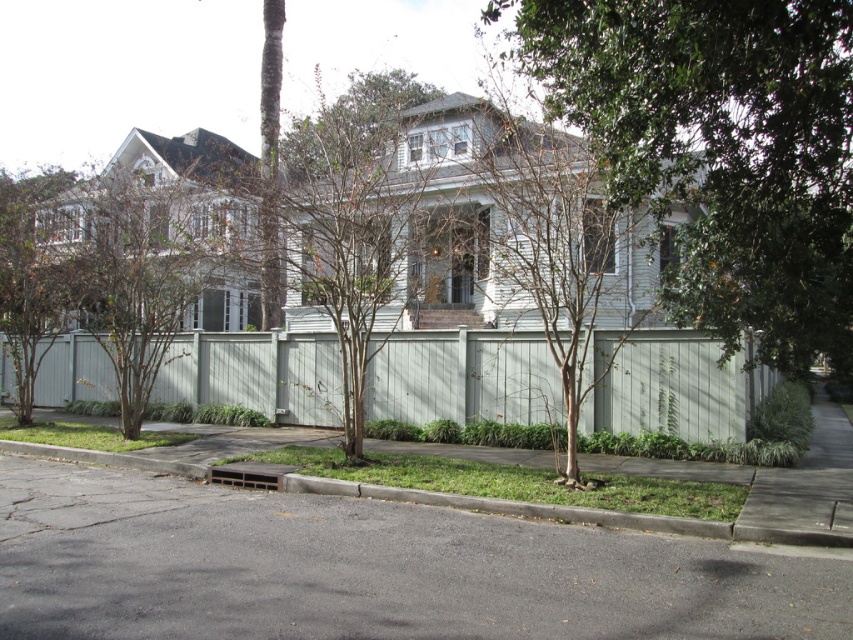
You are standing at the center of the residential street scene. There is a brown textured tree at center. Where is the point located at coordinates (550, 240) in relation to the brown textured tree at center?

The point located at coordinates (550, 240) corresponds to the brown textured tree at center.

You are a gardener planning to trim the green leafy tree at center and the brown textured tree at left. Which tree is located underneath the other?

The green leafy tree at center is positioned under the brown textured tree at left.